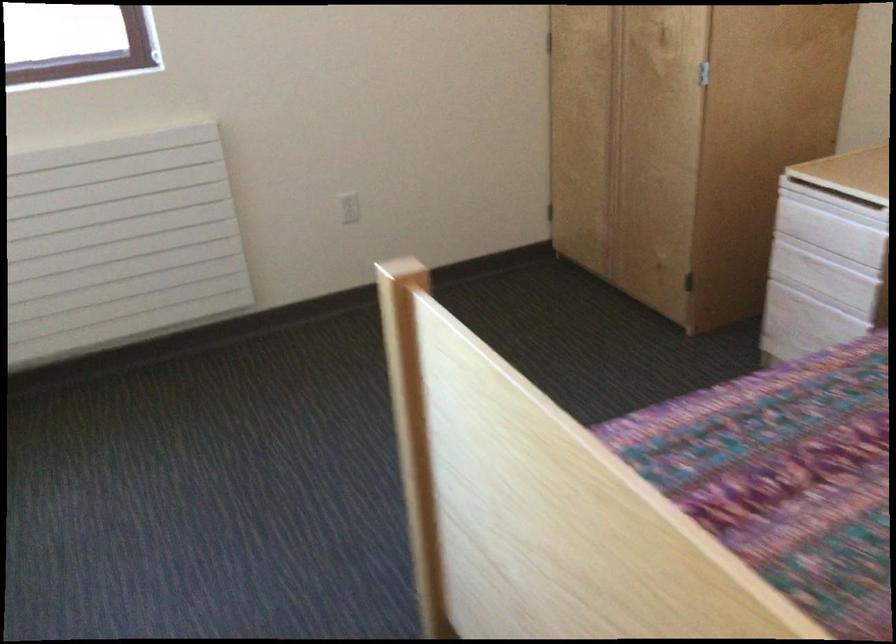
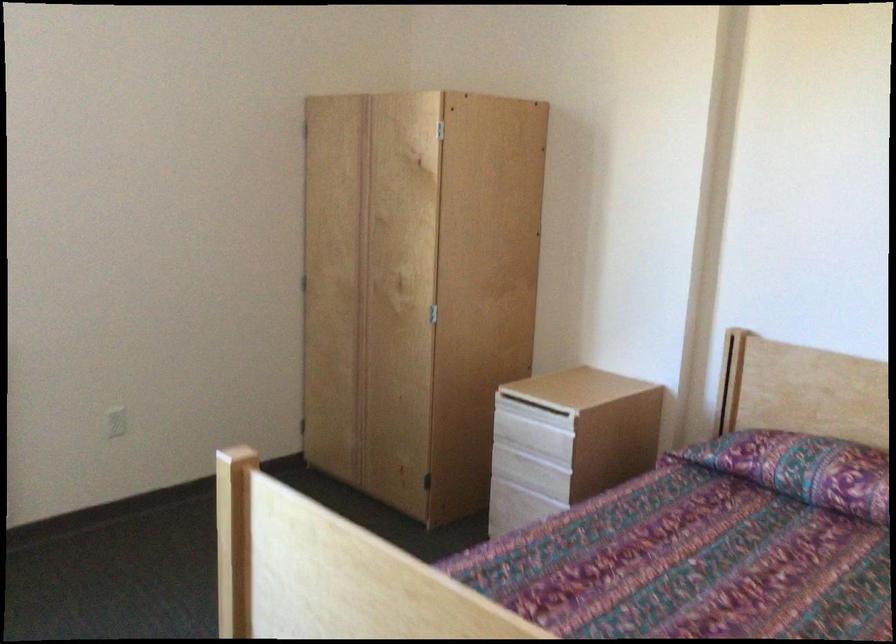
The images are taken continuously from a first-person perspective. In which direction is your viewpoint rotating?

The camera rotated toward right-up.